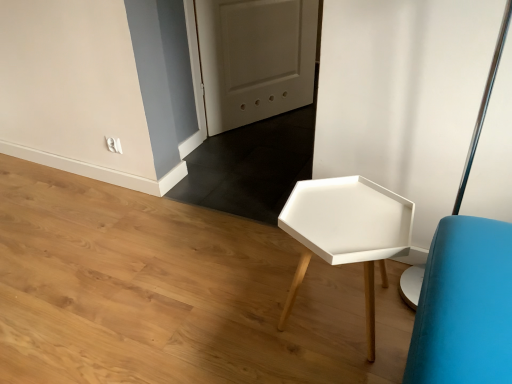
In order to face white matte hexagonal table at center, should I rotate leftwards or rightwards?

Turn right by 11.634 degrees to look at white matte hexagonal table at center.

Find the location of a particular element. Image resolution: width=512 pixels, height=384 pixels. white matte hexagonal table at center is located at coordinates (347, 232).

Describe the element at coordinates (347, 232) in the screenshot. I see `white matte hexagonal table at center` at that location.

Where is `white matte hexagonal table at center`? white matte hexagonal table at center is located at coordinates (347, 232).